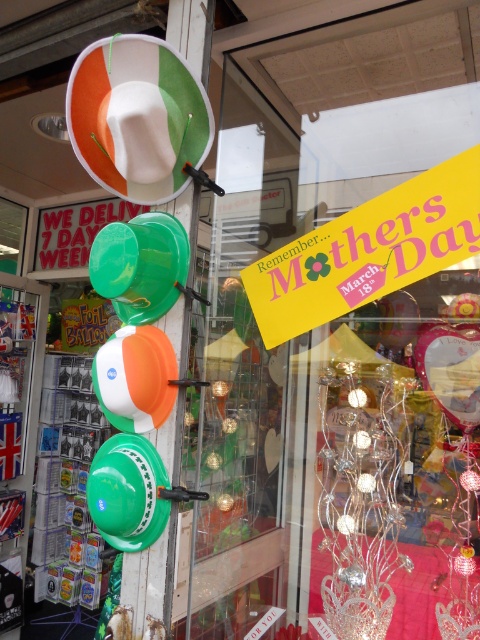
You are a customer at the store and want to place a white matte balloon at upper center and a green matte balloon at left on a shelf. The shelf is 30 inches long. Can both balloons fit side by side on the shelf?

The white matte balloon at upper center is 30.44 inches away from the green matte balloon at left. Since the distance between them is greater than the shelf length of 30 inches, they cannot fit side by side on the shelf.

You are organizing a Mother Day event and need to place the green matte balloon at left and orange and white glossy balloon at center on a table. The table is 10 inches wide. Can both balloons fit side by side without overlapping?

The green matte balloon at left is 6.19 inches from the orange and white glossy balloon at center. Since the table is 10 inches wide, which is wider than the distance between them, both balloons can fit side by side without overlapping.

You are planning to buy a balloon for Mother s Day. You want to choose the wider one between the white matte balloon at upper center and the orange and white glossy balloon at center. Which one should you pick?

The white matte balloon at upper center has a larger width than the orange and white glossy balloon at center, so you should pick the white matte balloon at upper center.